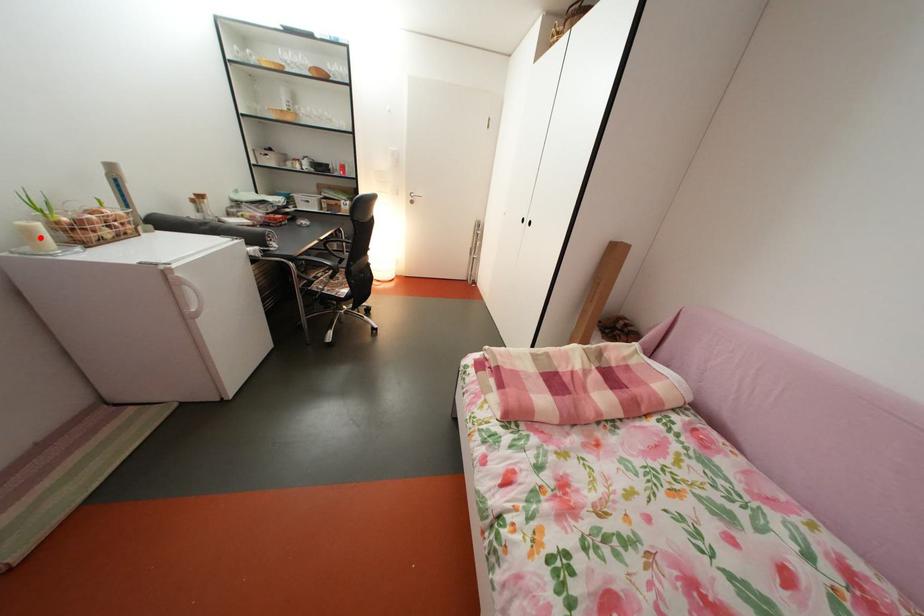
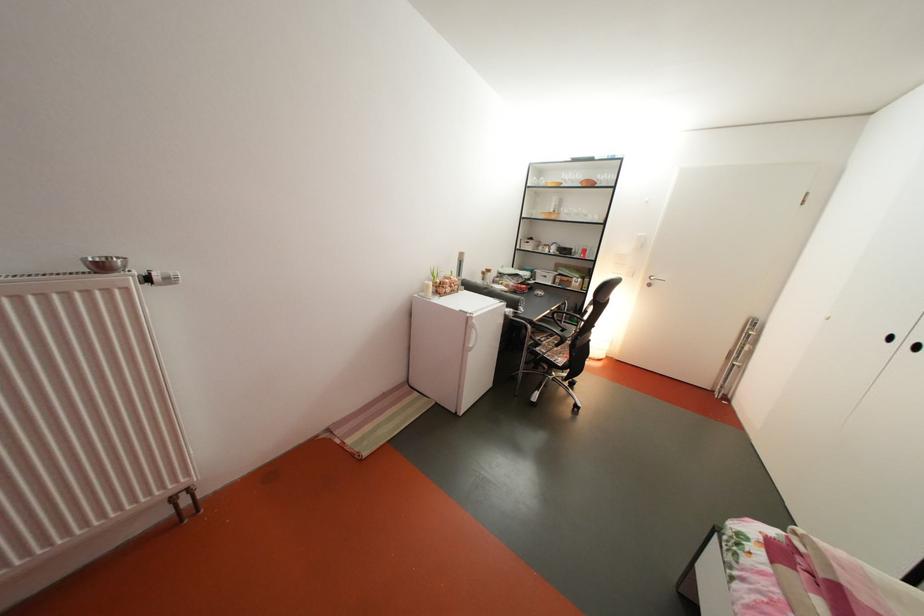
Question: I am providing you with two images of the same scene from different viewpoints. Image1 has a red point marked. In image2, the corresponding 3D location appears at what relative position? Reply with the corresponding letter.

Choices:
 (A) Closer
 (B) Farther

Answer: (A)